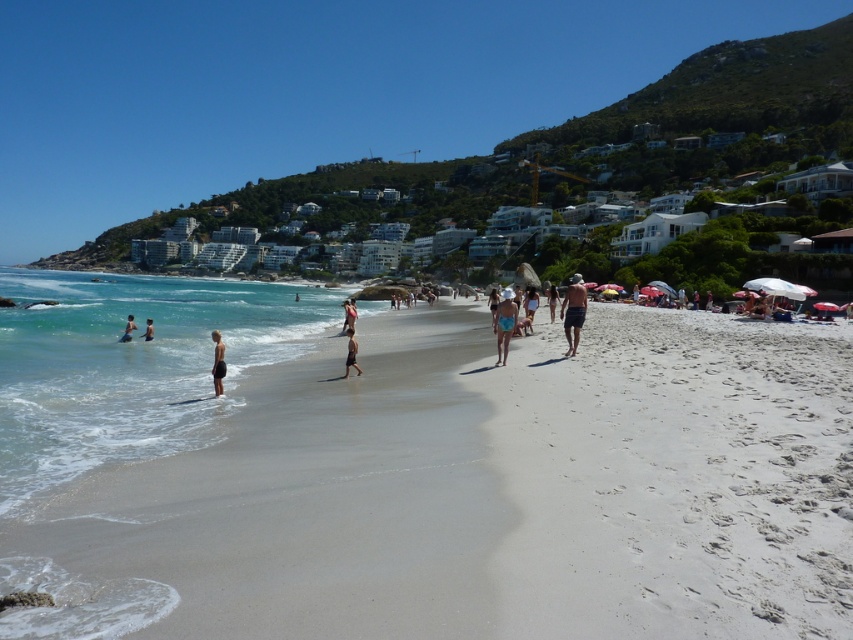
You are a photographer trying to capture a group shot of the dark gray shorts at center and the light blue swimwear at left. In the image, which swimwear is located to the left of the other?

The light blue swimwear at left is located to the left of the dark gray shorts at center.

You are a photographer taking a picture of the white sand beach at center and the blue fabric bikini at center. Based on their positions, which object will appear closer to the camera in the photo?

The white sand beach at center appears closer to the camera because it is positioned in front of the blue fabric bikini at center in the scene.